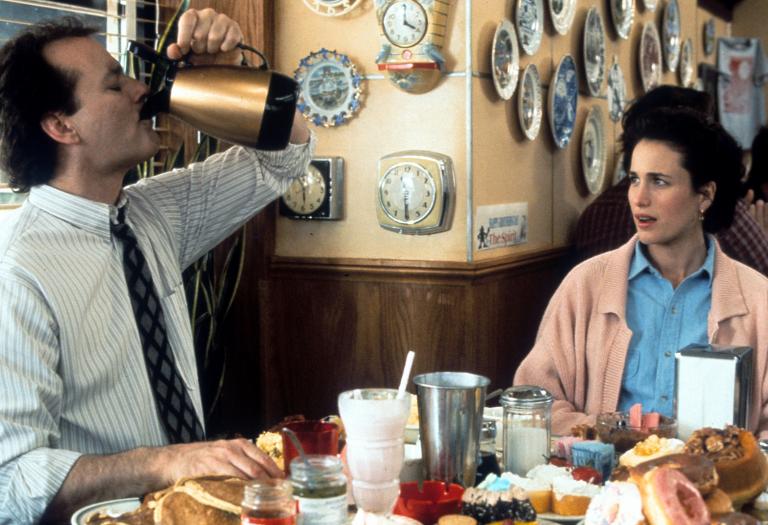
Identify the location of napkin holder. (690, 351).